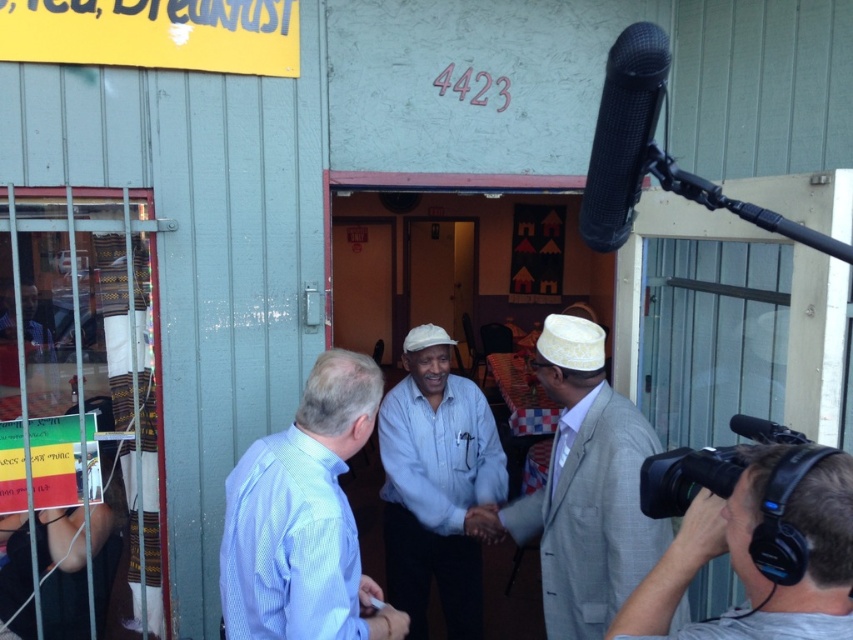
Is point (346, 589) positioned before point (772, 628)?

No.

Between point (288, 515) and point (833, 566), which one is positioned behind?

The point (288, 515) is more distant.

In order to click on light blue shirt at center in this screenshot , I will do `click(305, 518)`.

Can you confirm if white textured suit at center is positioned below gray fabric camera at lower right?

Yes.

Can you confirm if white textured suit at center is bigger than gray fabric camera at lower right?

Yes.

Measure the distance between point (643, 429) and camera.

They are 7.19 feet apart.

At what (x,y) coordinates should I click in order to perform the action: click on white textured suit at center. Please return your answer as a coordinate pair (x, y). Looking at the image, I should click on (584, 488).

Between white textured suit at center and white cotton shirt at center, which one appears on the right side from the viewer's perspective?

Positioned to the right is white textured suit at center.

Between white textured suit at center and white cotton shirt at center, which one has more height?

white cotton shirt at center

Does point (556, 580) come closer to viewer compared to point (410, 486)?

Yes, it is in front of point (410, 486).

Locate an element on the screen. The width and height of the screenshot is (853, 640). white textured suit at center is located at coordinates (584, 488).